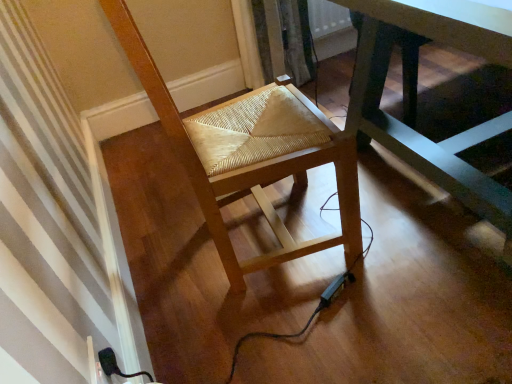
Locate an element on the screen. Image resolution: width=512 pixels, height=384 pixels. space that is in front of natural wood woven seat at center is located at coordinates (302, 330).